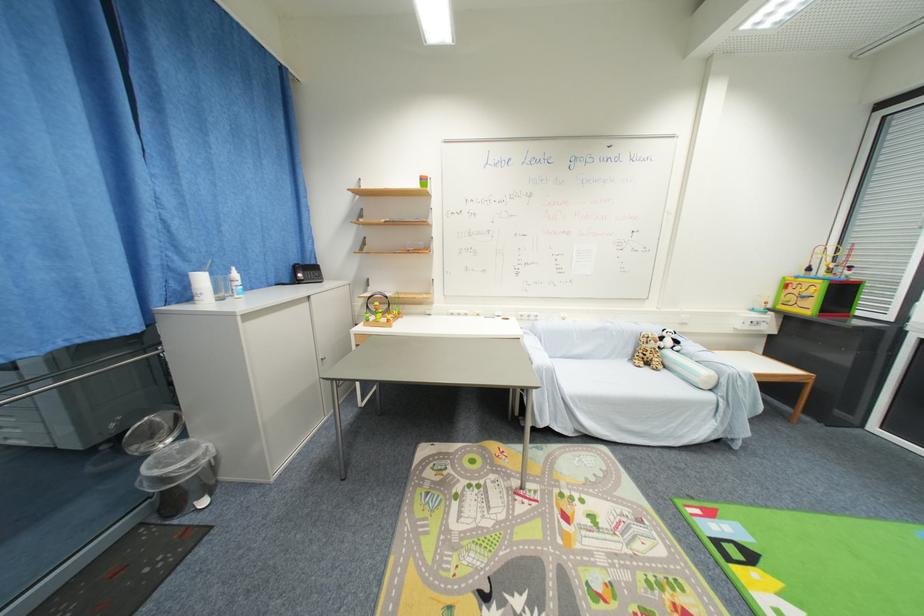
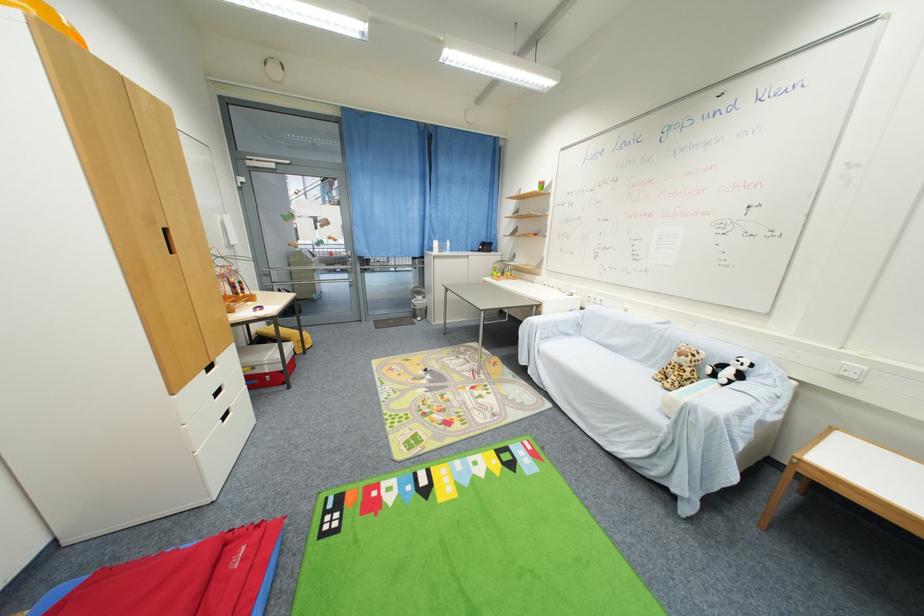
The point at (665, 341) is marked in the first image. Where is the corresponding point in the second image?

(727, 368)